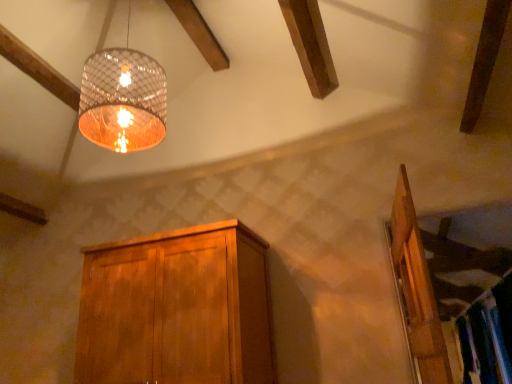
Question: From the image's perspective, is wooden cabinet at center above or below translucent glass lampshade at upper center?

Choices:
 (A) below
 (B) above

Answer: (A)

Question: From their relative heights in the image, would you say wooden cabinet at center is taller or shorter than translucent glass lampshade at upper center?

Choices:
 (A) short
 (B) tall

Answer: (A)

Question: Which object is the farthest from the translucent glass lampshade at upper center?

Choices:
 (A) wooden door at right
 (B) wooden cabinet at center

Answer: (A)

Question: Which object is positioned closest to the wooden cabinet at center?

Choices:
 (A) wooden door at right
 (B) translucent glass lampshade at upper center

Answer: (B)